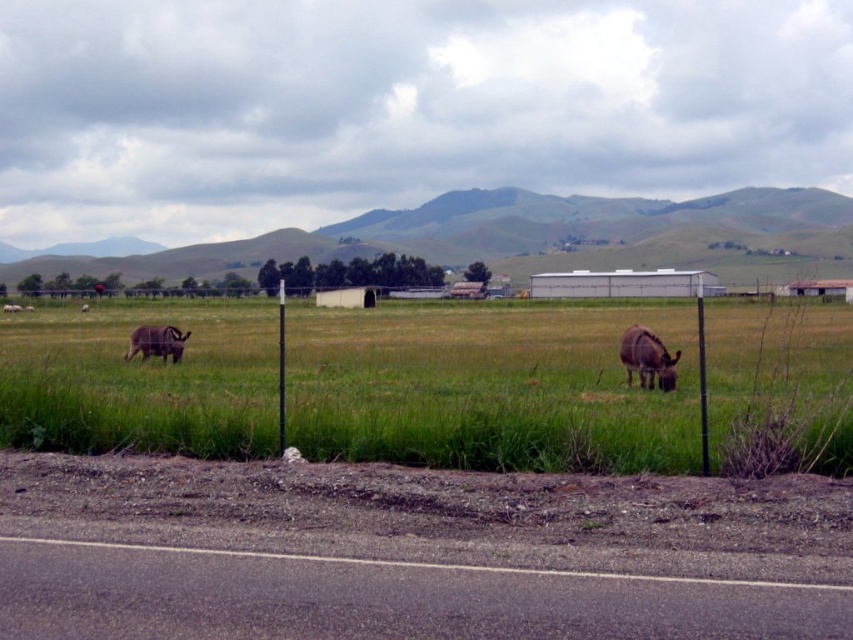
You are standing at the point with coordinates point (3, 308) and want to walk to the point with coordinates point (282, 330). Which direction should you move to get closer to your destination?

To reach point (282, 330) from point (3, 308), you should move upward because point (282, 330) is closer to the camera than point (3, 308).

You are a photographer trying to capture both the brown fuzzy donkey at center and the black metal pole at center in a single frame. Based on their sizes, which object should you focus on first to ensure both fit in the photo?

The brown fuzzy donkey at center has a lesser width compared to the black metal pole at center, so you should focus on the black metal pole at center first to accommodate its larger size in the frame.